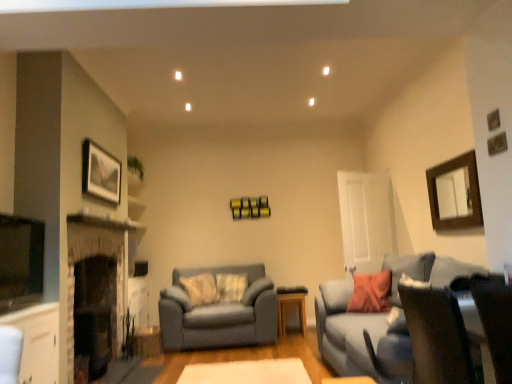
Question: Is matte gray couch at right, arranged as the second studio couch when viewed from the back, bigger or smaller than matte gray couch at center, the second studio couch positioned from the front?

Choices:
 (A) small
 (B) big

Answer: (B)

Question: Considering the positions of matte gray couch at right, marked as the 2th studio couch in a left-to-right arrangement, and matte gray couch at center, the second studio couch positioned from the front, in the image, is matte gray couch at right, marked as the 2th studio couch in a left-to-right arrangement, taller or shorter than matte gray couch at center, the second studio couch positioned from the front,?

Choices:
 (A) tall
 (B) short

Answer: (A)

Question: Based on their relative distances, which object is farther from the wooden mirror at upper right, which is the first picture frame from right to left?

Choices:
 (A) matte silver picture frame at upper left, positioned as the 1th picture frame in left-to-right order
 (B) white glossy door at center
 (C) matte gray couch at center, the 1th studio couch when ordered from left to right
 (D) white felt rug at center
 (E) light brown wooden table at center

Answer: (A)

Question: Estimate the real-world distances between objects in this image. Which object is farther from the white glossy door at center?

Choices:
 (A) matte gray couch at center, placed as the first studio couch when sorted from back to front
 (B) matte silver picture frame at upper left, positioned as the 1th picture frame in left-to-right order
 (C) wooden mirror at upper right, the second picture frame positioned from the left
 (D) matte gray couch at right, arranged as the second studio couch when viewed from the back
 (E) light brown wooden table at center

Answer: (B)